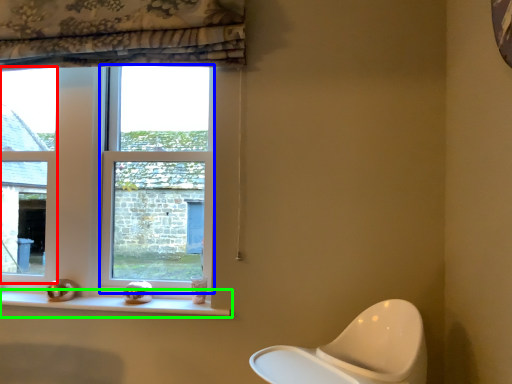
Question: Which object is the closest to the window (highlighted by a red box)? Choose among these: window (highlighted by a blue box) or window sill (highlighted by a green box).

Choices:
 (A) window
 (B) window sill

Answer: (A)